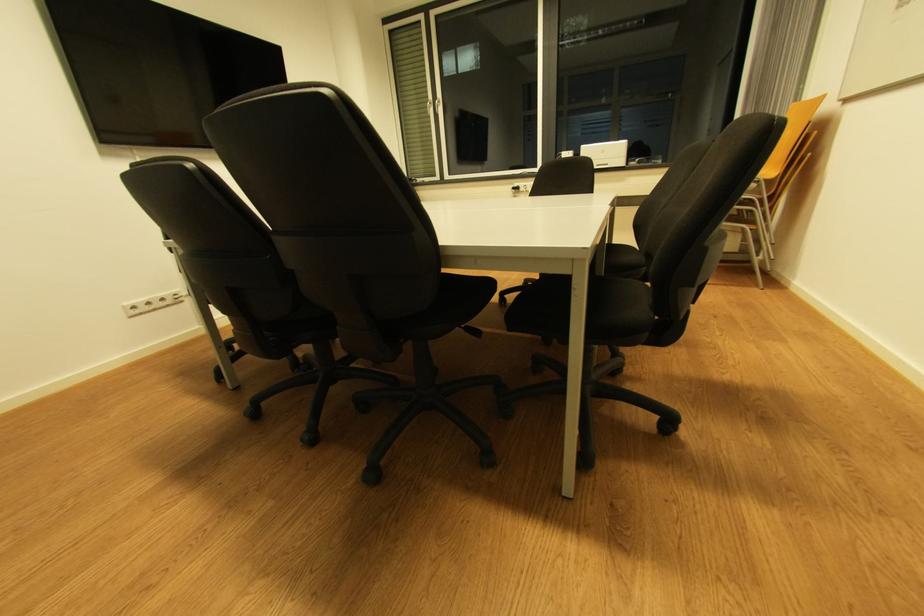
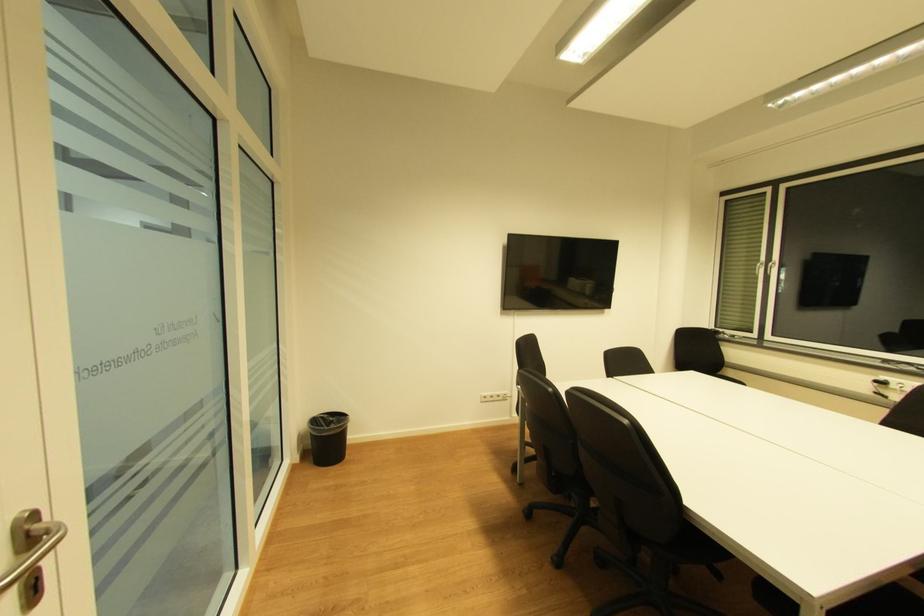
Question: The images are taken continuously from a first-person perspective. In which direction is your viewpoint rotating?

Choices:
 (A) Left
 (B) Right
 (C) Up
 (D) Down

Answer: (A)